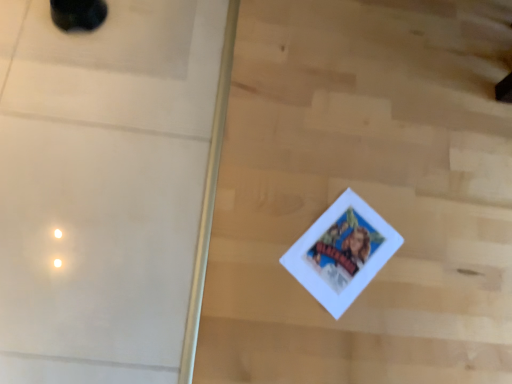
Where is `free location to the right of black rubber shoe at upper left`? This screenshot has width=512, height=384. free location to the right of black rubber shoe at upper left is located at coordinates (136, 36).